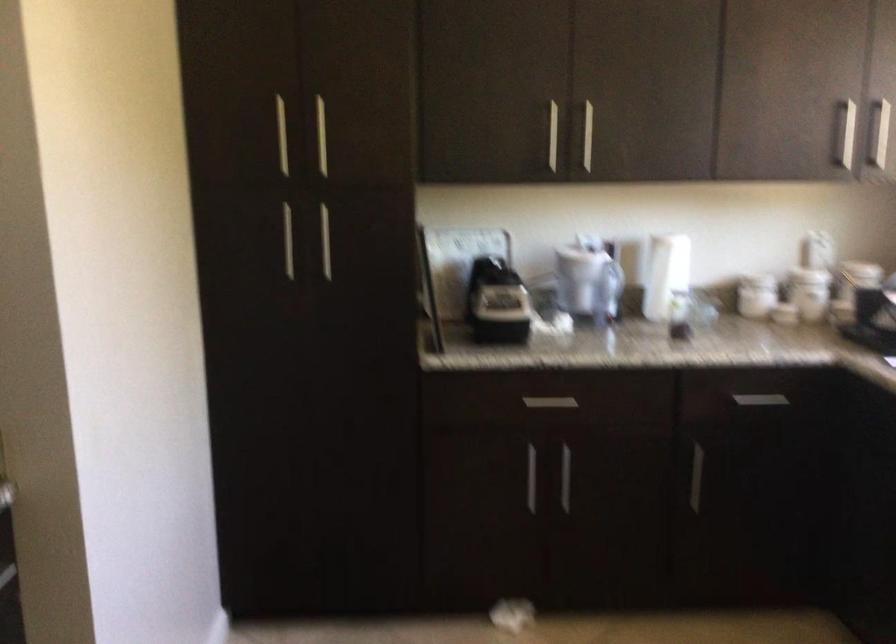
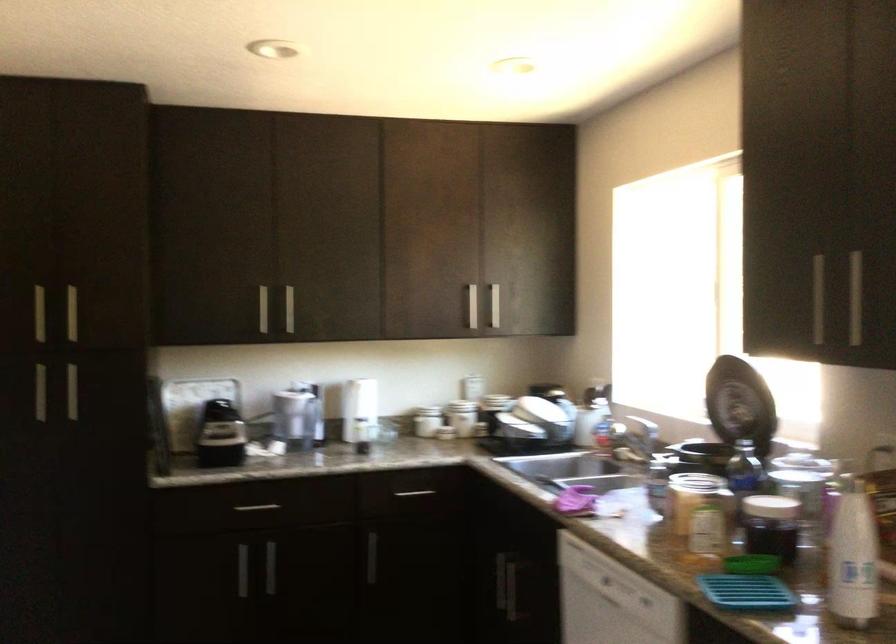
The point at (553, 137) is marked in the first image. Where is the corresponding point in the second image?

(263, 308)